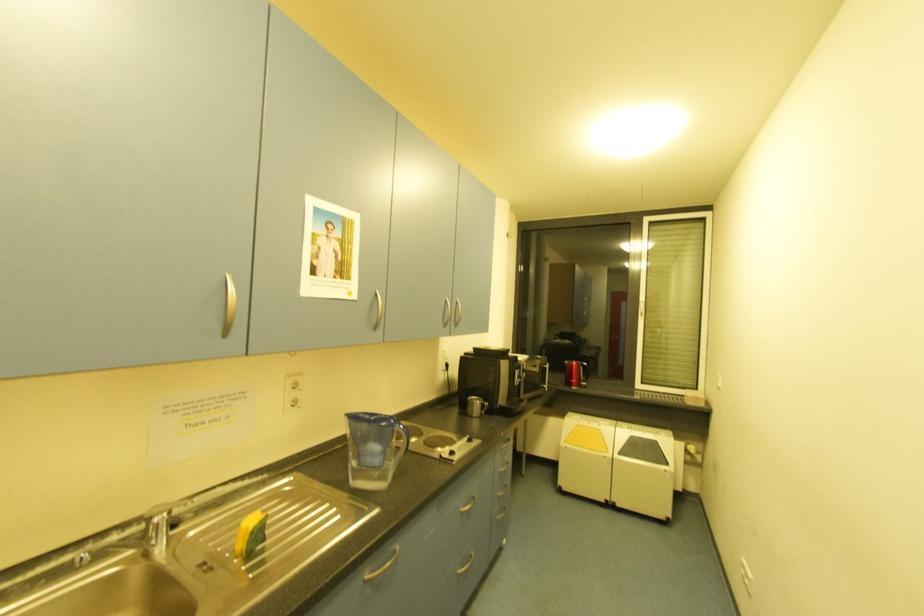
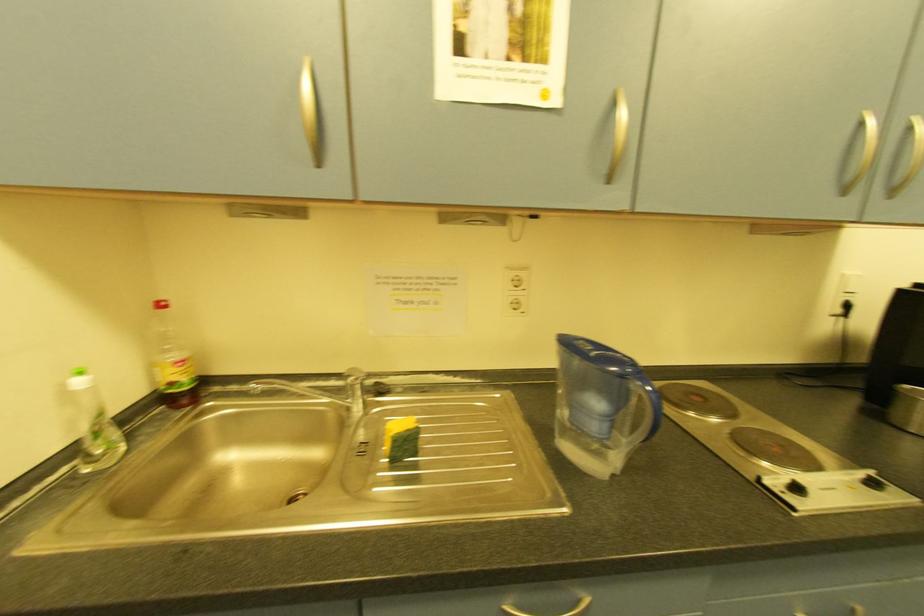
Question: The camera is either moving clockwise (left) or counter-clockwise (right) around the object. The first image is from the beginning of the video and the second image is from the end. Is the camera moving left or right when shooting the video?

Choices:
 (A) Left
 (B) Right

Answer: (B)